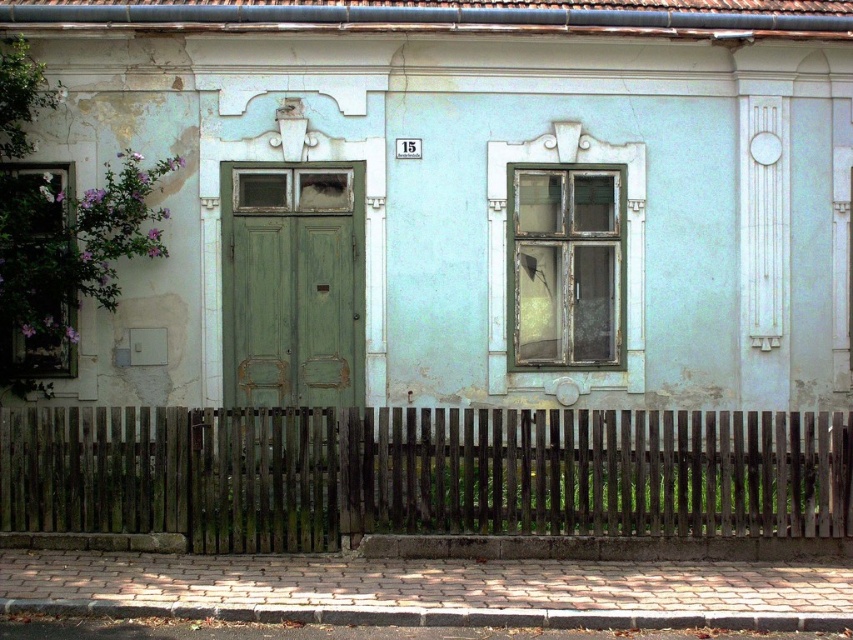
You are a delivery person with a package that requires a 10 feet clearance to pass through. You need to deliver it to the building shown in the image. Can you pass through the space between the weathered wood fence at lower center and the green matte door at center?

The distance between the weathered wood fence at lower center and the green matte door at center is 8.64 feet, which is less than the required 10 feet clearance. Therefore, the package cannot pass through this space.

You are standing at the point marked as point (296,497). You want to walk to the double doors in the center of the building facade. How far will you have to walk?

The distance between point (296,497) and the double doors in the center of the building facade is 9.49 meters, so you will have to walk 9.49 meters to reach them.